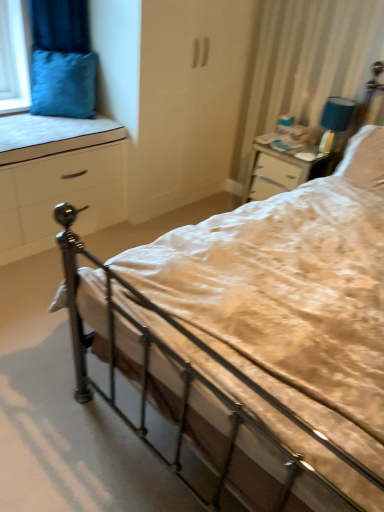
Question: Considering the relative positions of white matte chest of drawers at left and velvety blue pillow at upper left, which is counted as the 1th pillow, starting from the left, in the image provided, is white matte chest of drawers at left to the left or to the right of velvety blue pillow at upper left, which is counted as the 1th pillow, starting from the left,?

Choices:
 (A) left
 (B) right

Answer: (A)

Question: Choose the correct answer: Is white matte chest of drawers at left inside velvety blue pillow at upper left, which is the second pillow in right-to-left order, or outside it?

Choices:
 (A) outside
 (B) inside

Answer: (A)

Question: Estimate the real-world distances between objects in this image. Which object is farther from the blue fabric lampshade at upper right?

Choices:
 (A) white fabric mattress at left
 (B) velvety blue pillow at upper left, which is counted as the 1th pillow, starting from the left
 (C) white soft pillow at upper right, the 2th pillow viewed from the left
 (D) white matte chest of drawers at left

Answer: (B)

Question: Considering the real-world distances, which object is closest to the velvety blue pillow at upper left, which is the second pillow in right-to-left order?

Choices:
 (A) blue fabric lampshade at upper right
 (B) white fabric mattress at left
 (C) white soft pillow at upper right, placed as the first pillow when sorted from right to left
 (D) white matte chest of drawers at left

Answer: (B)